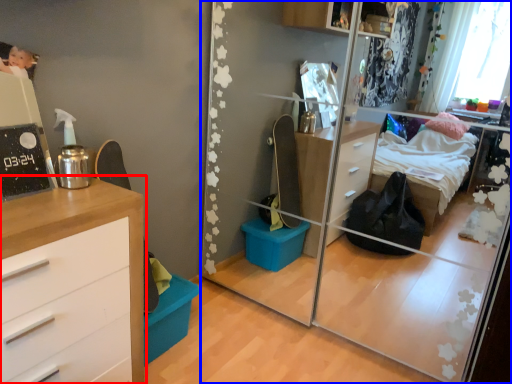
Question: Which object is further to the camera taking this photo, chest of drawers (highlighted by a red box) or mirror (highlighted by a blue box)?

Choices:
 (A) chest of drawers
 (B) mirror

Answer: (B)